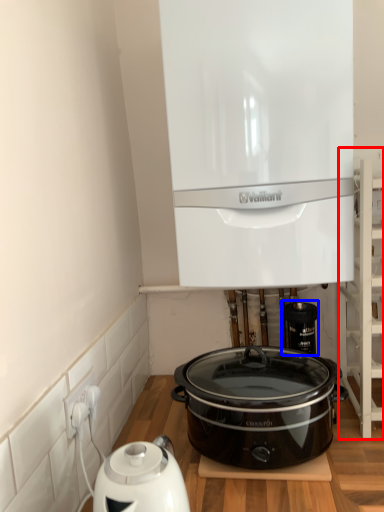
Question: Which point is further to the camera, shelf (highlighted by a red box) or appliance (highlighted by a blue box)?

Choices:
 (A) shelf
 (B) appliance

Answer: (B)